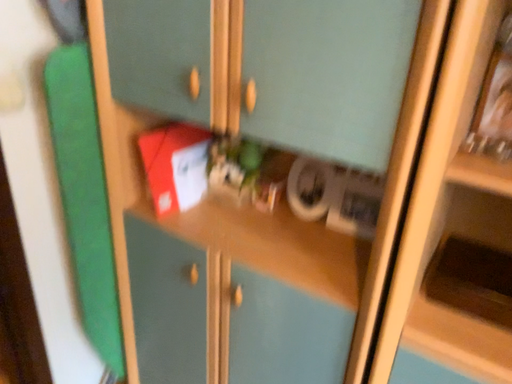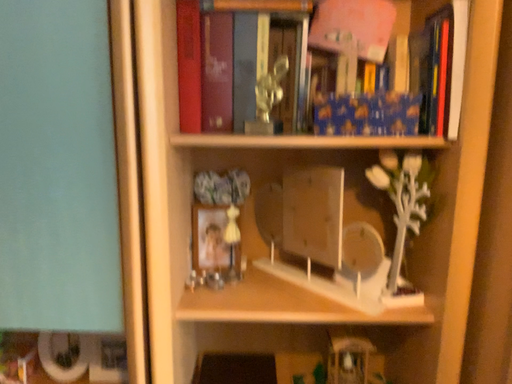
Question: How did the camera likely rotate when shooting the video?

Choices:
 (A) rotated downward
 (B) rotated upward

Answer: (B)